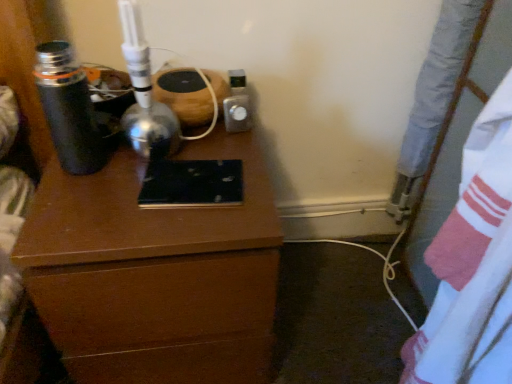
Question: Is brown wood chest of drawers at center wider or thinner than white cotton sheet at right?

Choices:
 (A) wide
 (B) thin

Answer: (A)

Question: From the image's perspective, is brown wood chest of drawers at center above or below white cotton sheet at right?

Choices:
 (A) above
 (B) below

Answer: (A)

Question: Considering the real-world distances, which object is farthest from the metallic silver thermos at left?

Choices:
 (A) white cotton sheet at right
 (B) brown wood chest of drawers at center

Answer: (A)

Question: Estimate the real-world distances between objects in this image. Which object is farther from the metallic silver thermos at left?

Choices:
 (A) white cotton sheet at right
 (B) brown wood chest of drawers at center

Answer: (A)